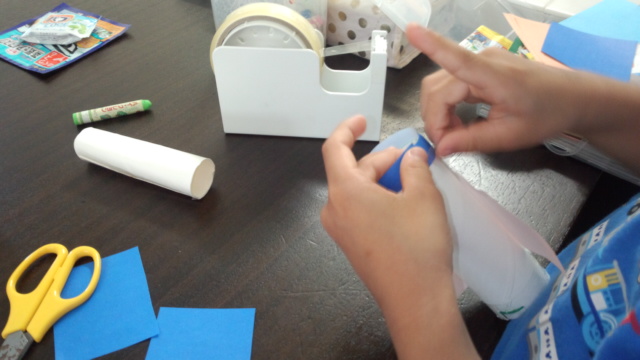
You are a GUI agent. You are given a task and a screenshot of the screen. Output one action in this format:
    pyautogui.click(x=<x>, y=<y>)
    Task: Click on the table
    
    Given the screenshot: What is the action you would take?
    pyautogui.click(x=271, y=208)